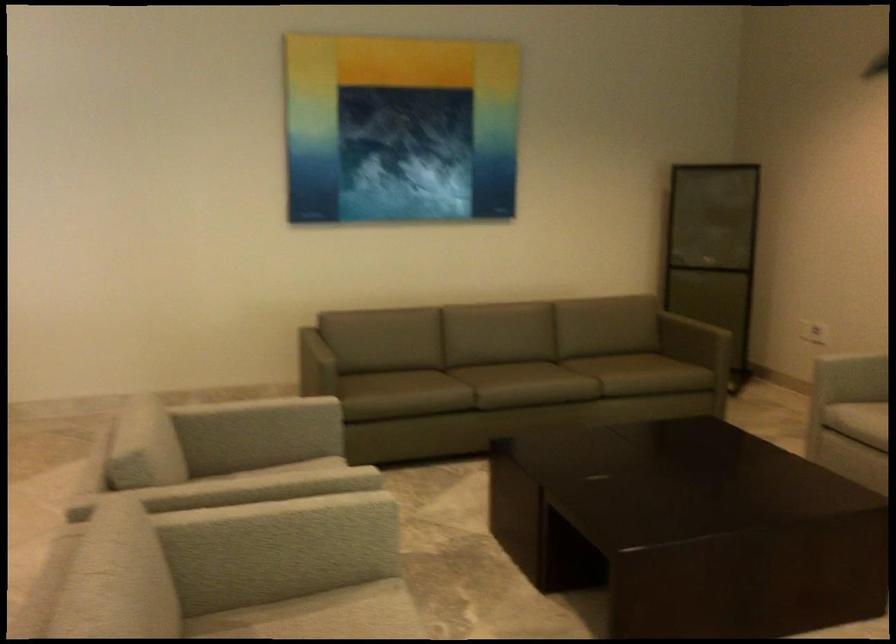
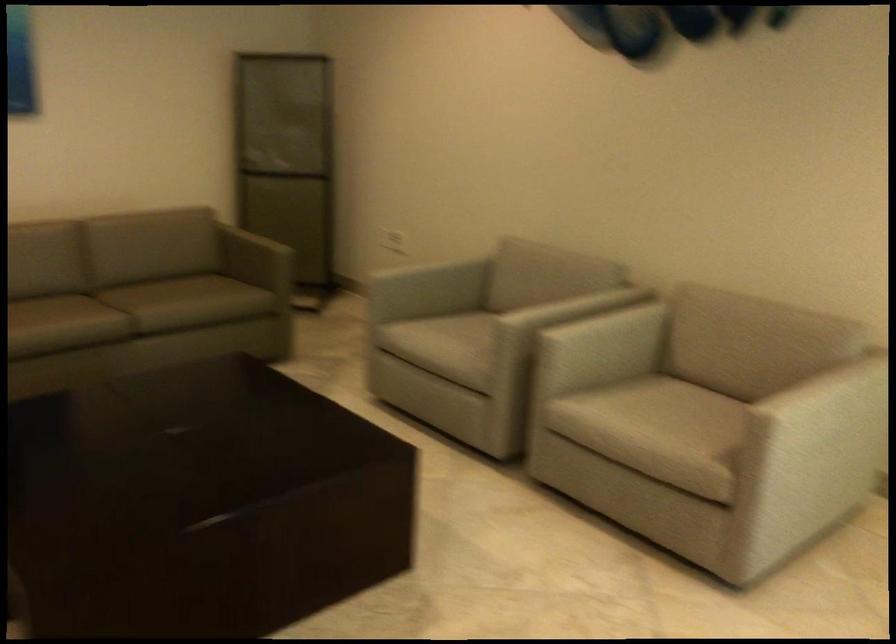
Question: How did the camera likely rotate?

Choices:
 (A) Left
 (B) Right
 (C) Up
 (D) Down

Answer: (B)